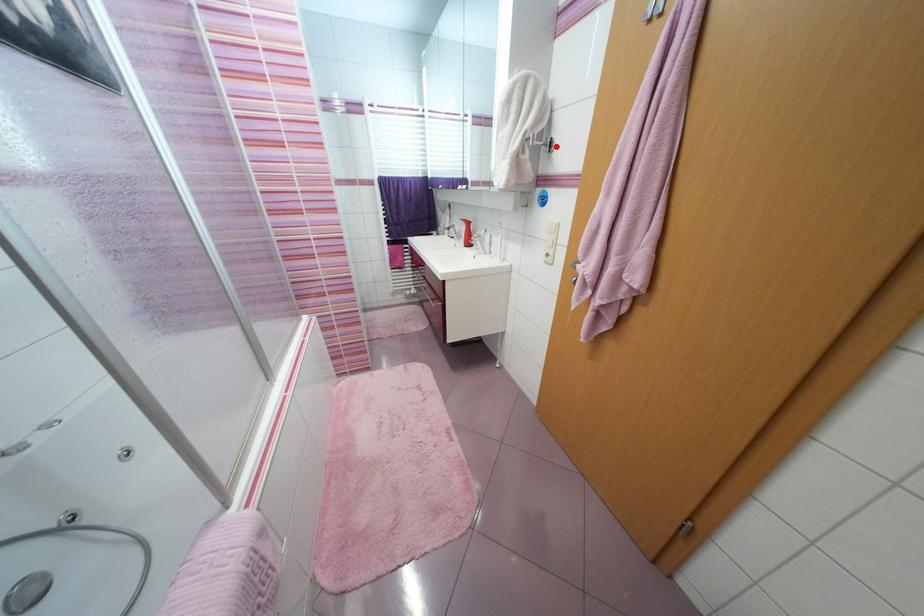
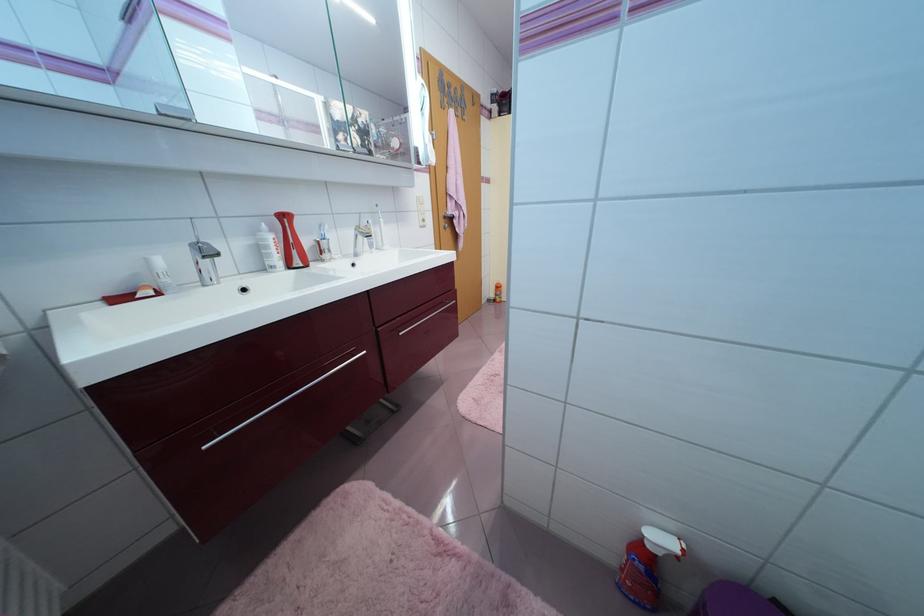
Question: I am providing you with two images of the same scene from different viewpoints. A red point is marked on the first image. At the location where the point appears in image 1, is it still visible in image 2?

Choices:
 (A) Yes
 (B) No

Answer: (B)